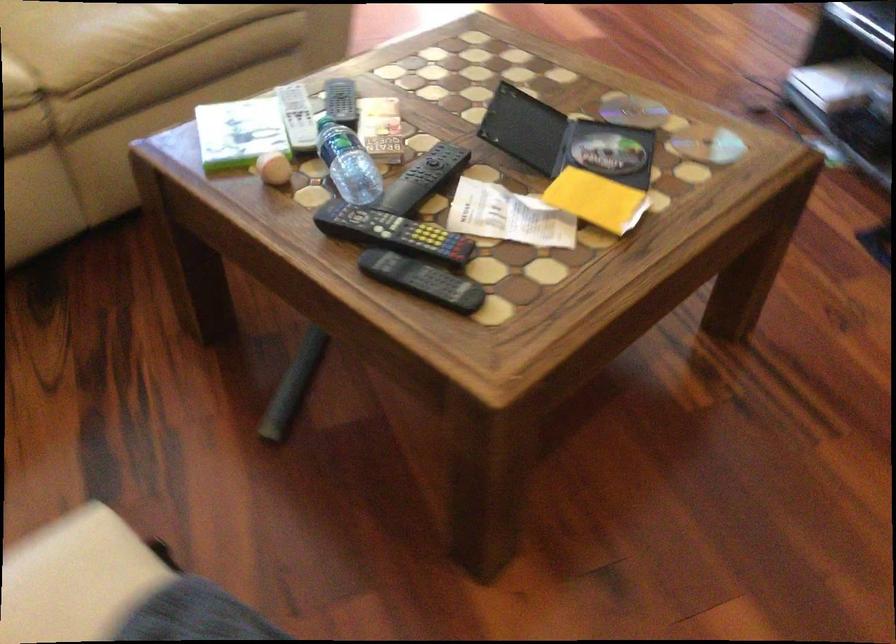
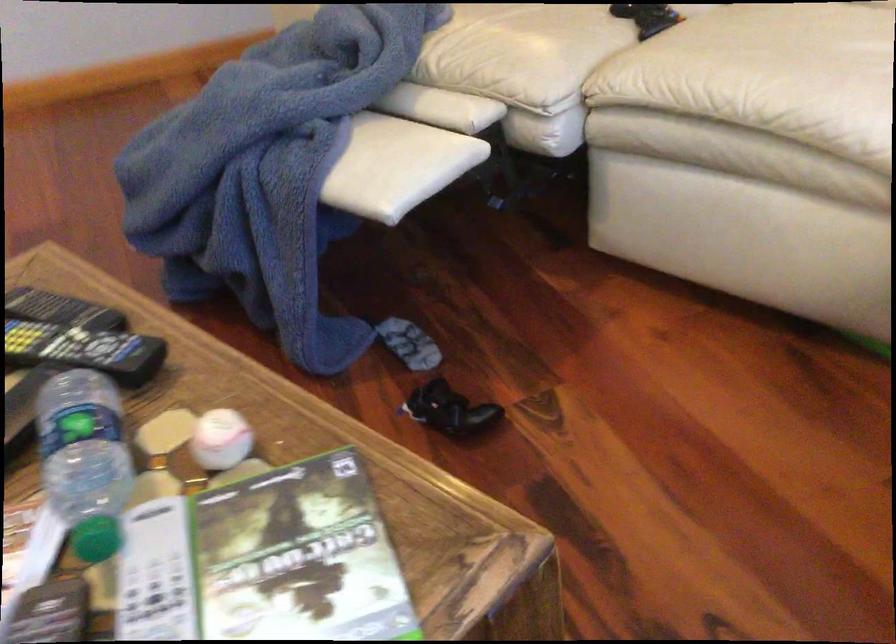
Where in the second image is the point corresponding to the point at 285,143 from the first image?

(220, 439)